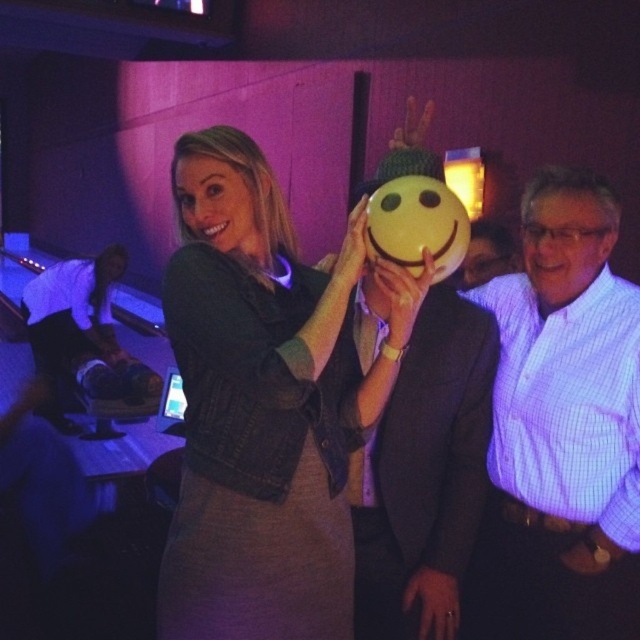
Looking at this image, you are a photographer at the party and want to capture a photo that includes both the matte purple shirt at right and the matte plastic face at center. Which object should you focus on first if you want to ensure both are in frame?

You should focus on the matte purple shirt at right first because it is taller than the matte plastic face at center, ensuring it fits within the frame properly.

You are a photographer at the party and want to take a closeup shot of the white checkered shirt at center and the smooth skin face at center. Which one should you focus on first if you want to capture both in focus?

The white checkered shirt at center is below the smooth skin face at center, so you should focus on the smooth skin face at center first to ensure both are in focus.